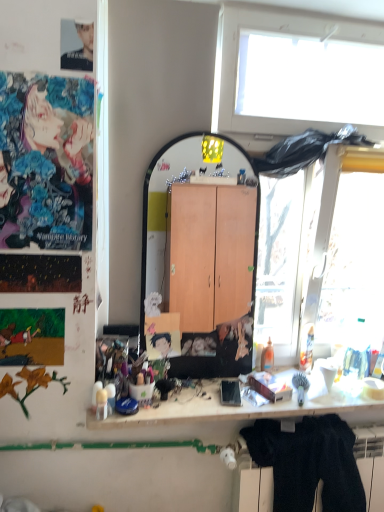
I want to click on white matte desk at center, so click(x=251, y=407).

Measure the distance between point (x=344, y=467) and camera.

The depth of point (x=344, y=467) is 5.42 feet.

Find the location of a particular element. vivid anime poster at upper left, the 1th person viewed from the front is located at coordinates (46, 161).

The image size is (384, 512). What do you see at coordinates (76, 45) in the screenshot?
I see `matte black photo at upper left, the 2th person when ordered from right to left` at bounding box center [76, 45].

You are a GUI agent. You are given a task and a screenshot of the screen. Output one action in this format:
    pyautogui.click(x=<x>, y=<y>)
    Task: Click on the smooth black hair at center, positioned as the third person in left-to-right order
    
    Given the screenshot: What is the action you would take?
    pyautogui.click(x=166, y=343)

Where is `desk on the right of matte black photo at upper left, which is counted as the first person, starting from the top`? Image resolution: width=384 pixels, height=512 pixels. desk on the right of matte black photo at upper left, which is counted as the first person, starting from the top is located at coordinates (251, 407).

Who is shorter, white matte desk at center or matte black photo at upper left, the 2th person when ordered from right to left?

white matte desk at center is shorter.

From the image's perspective, which one is positioned lower, white matte desk at center or matte black photo at upper left, which is counted as the first person, starting from the top?

From the image's view, white matte desk at center is below.

Does point (329, 400) come behind point (71, 30)?

Yes, it is.

Would you say white matte desk at center contains smooth black hair at center, placed as the 3th person when sorted from top to bottom?

Actually, smooth black hair at center, placed as the 3th person when sorted from top to bottom, is outside white matte desk at center.

Measure the distance from white matte desk at center to smooth black hair at center, placed as the 3th person when sorted from top to bottom.

The distance of white matte desk at center from smooth black hair at center, placed as the 3th person when sorted from top to bottom, is 15.37 inches.

Find the location of a particular element. desk on the right of the smooth black hair at center, positioned as the third person in left-to-right order is located at coordinates (251, 407).

From the image's perspective, relative to smooth black hair at center, placed as the 3th person when sorted from top to bottom, is white matte desk at center above or below?

white matte desk at center is below smooth black hair at center, placed as the 3th person when sorted from top to bottom.

How far apart are vivid anime poster at upper left, the second person when ordered from top to bottom, and matte black photo at upper left, placed as the 2th person when sorted from front to back?

They are 11.64 inches apart.

Is vivid anime poster at upper left, the 1th person viewed from the front, oriented towards matte black photo at upper left, placed as the 2th person when sorted from front to back?

No, vivid anime poster at upper left, the 1th person viewed from the front, is not aimed at matte black photo at upper left, placed as the 2th person when sorted from front to back.

Which is more to the left, vivid anime poster at upper left, placed as the 3th person when sorted from back to front, or matte black photo at upper left, which appears as the second person when viewed from the back?

vivid anime poster at upper left, placed as the 3th person when sorted from back to front.

Which of these two, vivid anime poster at upper left, marked as the third person in a right-to-left arrangement, or matte black photo at upper left, placed as the 2th person when sorted from front to back, is wider?

With larger width is vivid anime poster at upper left, marked as the third person in a right-to-left arrangement.

From a real-world perspective, which object rests below the other?

smooth black hair at center, the 1th person in the right-to-left sequence.

Which is correct: matte black photo at upper left, which is counted as the first person, starting from the top, is inside smooth black hair at center, which ranks as the 1th person in bottom-to-top order, or outside of it?

The correct answer is: outside.

Is matte black photo at upper left, which ranks as the second person in left-to-right order, to the left of smooth black hair at center, acting as the third person starting from the front, from the viewer's perspective?

Correct, you'll find matte black photo at upper left, which ranks as the second person in left-to-right order, to the left of smooth black hair at center, acting as the third person starting from the front.

Is matte black photo at upper left, which appears as the second person when viewed from the back, thinner than smooth black hair at center, the 1th person in the right-to-left sequence?

Indeed, matte black photo at upper left, which appears as the second person when viewed from the back, has a lesser width compared to smooth black hair at center, the 1th person in the right-to-left sequence.

Between white matte desk at center and black fuzzy sweater at lower right, which one has smaller width?

With smaller width is black fuzzy sweater at lower right.

From the image's perspective, between white matte desk at center and black fuzzy sweater at lower right, which one is located above?

From the image's view, white matte desk at center is above.

Is white matte desk at center turned away from black fuzzy sweater at lower right?

No.

Locate an element on the screen. The width and height of the screenshot is (384, 512). clothing located on the right of white matte desk at center is located at coordinates (309, 463).

Considering the sizes of objects smooth black hair at center, which ranks as the 1th person in bottom-to-top order, and vivid anime poster at upper left, the 1th person viewed from the front, in the image provided, who is thinner, smooth black hair at center, which ranks as the 1th person in bottom-to-top order, or vivid anime poster at upper left, the 1th person viewed from the front,?

With smaller width is vivid anime poster at upper left, the 1th person viewed from the front.

Is smooth black hair at center, the 1th person in the right-to-left sequence, turned away from vivid anime poster at upper left, marked as the third person in a right-to-left arrangement?

smooth black hair at center, the 1th person in the right-to-left sequence, is not turned away from vivid anime poster at upper left, marked as the third person in a right-to-left arrangement.

Does point (168, 348) come in front of point (55, 87)?

No, it is not.

In the scene shown: Can you see smooth black hair at center, the 1th person in the right-to-left sequence, touching vivid anime poster at upper left, which ranks as the first person in left-to-right order?

smooth black hair at center, the 1th person in the right-to-left sequence, is not next to vivid anime poster at upper left, which ranks as the first person in left-to-right order, and they're not touching.

Identify the location of desk lying below the vivid anime poster at upper left, marked as the third person in a right-to-left arrangement (from the image's perspective). (251, 407).

Can white matte desk at center be found inside vivid anime poster at upper left, the 2th person positioned from the bottom?

That's incorrect, white matte desk at center is not inside vivid anime poster at upper left, the 2th person positioned from the bottom.

From the image's perspective, is vivid anime poster at upper left, the 1th person viewed from the front, positioned above or below white matte desk at center?

From the image's perspective, vivid anime poster at upper left, the 1th person viewed from the front, appears above white matte desk at center.

Between vivid anime poster at upper left, the 2th person positioned from the bottom, and white matte desk at center, which one has larger width?

white matte desk at center.

From the image's perspective, which person is the 3rd one above the white matte desk at center? Please provide its 2D coordinates.

[(76, 45)]

At what (x,y) coordinates should I click in order to perform the action: click on desk in front of the smooth black hair at center, placed as the 3th person when sorted from top to bottom. Please return your answer as a coordinate pair (x, y). The width and height of the screenshot is (384, 512). Looking at the image, I should click on (251, 407).

Looking at the image, which one is located closer to white matte desk at center, vivid anime poster at upper left, the 1th person viewed from the front, or smooth black hair at center, acting as the third person starting from the front?

smooth black hair at center, acting as the third person starting from the front.

When comparing their distances from white matte desk at center, does matte black photo at upper left, which is the 3th person in bottom-to-top order, or smooth black hair at center, positioned as the third person in left-to-right order, seem further?

matte black photo at upper left, which is the 3th person in bottom-to-top order, is positioned further to the anchor white matte desk at center.

Estimate the real-world distances between objects in this image. Which object is closer to smooth black hair at center, acting as the third person starting from the front, matte black photo at upper left, which appears as the second person when viewed from the back, or vivid anime poster at upper left, marked as the third person in a right-to-left arrangement?

vivid anime poster at upper left, marked as the third person in a right-to-left arrangement, lies closer to smooth black hair at center, acting as the third person starting from the front, than the other object.

Which object lies nearer to the anchor point vivid anime poster at upper left, the second person when ordered from top to bottom, black fuzzy sweater at lower right or matte black photo at upper left, which ranks as the second person in left-to-right order?

The object closer to vivid anime poster at upper left, the second person when ordered from top to bottom, is matte black photo at upper left, which ranks as the second person in left-to-right order.

Based on their spatial positions, is black fuzzy sweater at lower right or smooth black hair at center, which ranks as the 1th person in bottom-to-top order, further from white matte desk at center?

smooth black hair at center, which ranks as the 1th person in bottom-to-top order, is further to white matte desk at center.

When comparing their distances from matte black photo at upper left, which is counted as the first person, starting from the top, does smooth black hair at center, which ranks as the 1th person in bottom-to-top order, or white matte desk at center seem further?

white matte desk at center.

Based on their spatial positions, is vivid anime poster at upper left, marked as the third person in a right-to-left arrangement, or matte black photo at upper left, the 2th person when ordered from right to left, closer to black fuzzy sweater at lower right?

The object closer to black fuzzy sweater at lower right is vivid anime poster at upper left, marked as the third person in a right-to-left arrangement.

From the image, which object appears to be nearer to smooth black hair at center, the 1th person in the right-to-left sequence, black fuzzy sweater at lower right or white matte desk at center?

white matte desk at center is closer to smooth black hair at center, the 1th person in the right-to-left sequence.

The height and width of the screenshot is (512, 384). I want to click on person between vivid anime poster at upper left, the 1th person viewed from the front, and white matte desk at center vertically, so click(x=166, y=343).

Find the location of `desk between vivid anime poster at upper left, the 1th person viewed from the front, and black fuzzy sweater at lower right, in the vertical direction`. desk between vivid anime poster at upper left, the 1th person viewed from the front, and black fuzzy sweater at lower right, in the vertical direction is located at coordinates (251, 407).

Find the location of a particular element. This screenshot has height=512, width=384. desk between smooth black hair at center, which ranks as the 1th person in bottom-to-top order, and black fuzzy sweater at lower right, in the horizontal direction is located at coordinates (251, 407).

The width and height of the screenshot is (384, 512). I want to click on person between matte black photo at upper left, which is the 3th person in bottom-to-top order, and smooth black hair at center, positioned as the third person in left-to-right order, vertically, so click(46, 161).